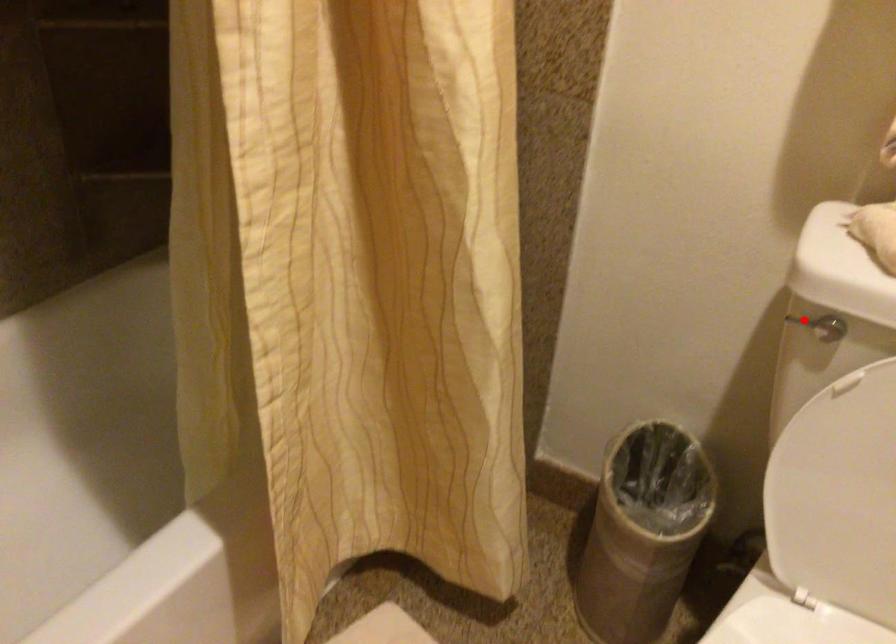
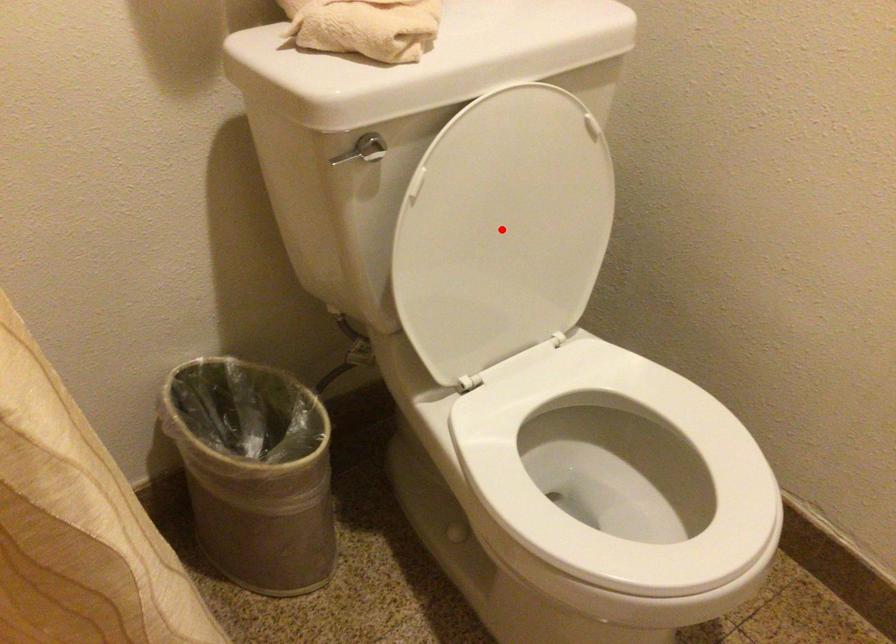
I am providing you with two images of the same scene from different viewpoints. A red point is marked on the first image and another point is marked on the second image. Is the red point in image1 aligned with the point shown in image2?

No